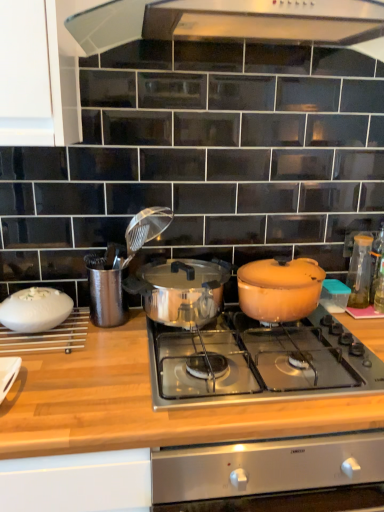
Question: Is polished stainless steel pot at center, arranged as the 2th pot/pan when viewed from the right, positioned with its back to shiny stainless steel cooktop at center?

Choices:
 (A) no
 (B) yes

Answer: (A)

Question: Is polished stainless steel pot at center, arranged as the 2th pot/pan when viewed from the right, next to shiny stainless steel cooktop at center?

Choices:
 (A) yes
 (B) no

Answer: (B)

Question: From a real-world perspective, is polished stainless steel pot at center, arranged as the 2th pot/pan when viewed from the right, located higher than shiny stainless steel cooktop at center?

Choices:
 (A) no
 (B) yes

Answer: (B)

Question: Considering the relative sizes of polished stainless steel pot at center, which is the 1th pot/pan from left to right, and shiny stainless steel cooktop at center in the image provided, is polished stainless steel pot at center, which is the 1th pot/pan from left to right, shorter than shiny stainless steel cooktop at center?

Choices:
 (A) no
 (B) yes

Answer: (A)

Question: Can shiny stainless steel cooktop at center be found inside polished stainless steel pot at center, which is the 1th pot/pan from left to right?

Choices:
 (A) no
 (B) yes

Answer: (A)

Question: Choose the correct answer: Is transparent glass bottle at right, which is the 1th kitchen appliance from back to front, inside shiny stainless steel cooktop at center or outside it?

Choices:
 (A) outside
 (B) inside

Answer: (A)

Question: Is transparent glass bottle at right, which is the second kitchen appliance from front to back, wider or thinner than shiny stainless steel cooktop at center?

Choices:
 (A) wide
 (B) thin

Answer: (B)

Question: From the image's perspective, relative to shiny stainless steel cooktop at center, is transparent glass bottle at right, which is the second kitchen appliance in left-to-right order, above or below?

Choices:
 (A) below
 (B) above

Answer: (B)

Question: From their relative heights in the image, would you say transparent glass bottle at right, which is the 1th kitchen appliance from back to front, is taller or shorter than shiny stainless steel cooktop at center?

Choices:
 (A) short
 (B) tall

Answer: (B)

Question: Considering the positions of matte orange pot at center right, which appears as the second pot/pan when viewed from the left, and white matte bowl at left, the 2th kitchen appliance from the right, in the image, is matte orange pot at center right, which appears as the second pot/pan when viewed from the left, wider or thinner than white matte bowl at left, the 2th kitchen appliance from the right,?

Choices:
 (A) thin
 (B) wide

Answer: (B)

Question: Do you think matte orange pot at center right, which appears as the second pot/pan when viewed from the left, is within white matte bowl at left, acting as the first kitchen appliance starting from the left, or outside of it?

Choices:
 (A) inside
 (B) outside

Answer: (B)

Question: Considering the positions of matte orange pot at center right, which appears as the second pot/pan when viewed from the left, and white matte bowl at left, the 2th kitchen appliance from the right, in the image, is matte orange pot at center right, which appears as the second pot/pan when viewed from the left, taller or shorter than white matte bowl at left, the 2th kitchen appliance from the right,?

Choices:
 (A) tall
 (B) short

Answer: (A)

Question: Does point (263, 285) appear closer or farther from the camera than point (29, 329)?

Choices:
 (A) closer
 (B) farther

Answer: (B)

Question: In the image, is transparent glass bottle at right, which is the 1th kitchen appliance from back to front, positioned in front of or behind wooden at center?

Choices:
 (A) behind
 (B) front

Answer: (A)

Question: Would you say transparent glass bottle at right, which is the second kitchen appliance from front to back, is inside or outside wooden at center?

Choices:
 (A) inside
 (B) outside

Answer: (B)